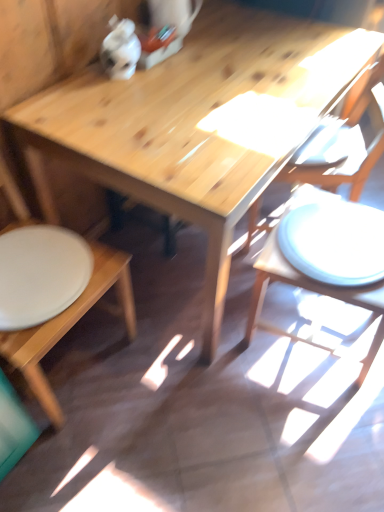
This screenshot has height=512, width=384. I want to click on free point below wooden chair at lower left, positioned as the first chair in left-to-right order (from a real-world perspective), so click(75, 354).